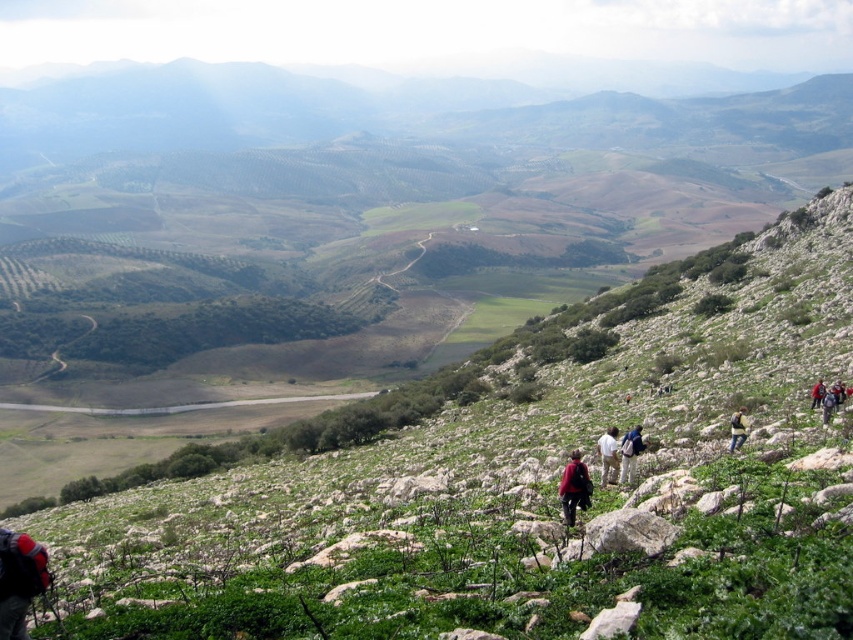
Question: Which is farther from the light brown fabric backpack at lower right?

Choices:
 (A) dark blue backpack at lower right
 (B) red fabric backpack at lower right
 (C) blue fabric backpack at center-right
 (D) dark red backpack at center

Answer: (B)

Question: Which of the following is the farthest from the observer?

Choices:
 (A) dark blue backpack at lower right
 (B) blue fabric backpack at center-right
 (C) light brown fabric backpack at lower right
 (D) dark red backpack at center

Answer: (A)

Question: Can you confirm if blue fabric backpack at center-right is bigger than red fabric backpack at lower right?

Choices:
 (A) no
 (B) yes

Answer: (B)

Question: Is the position of blue fabric backpack at center-right less distant than that of red fabric backpack at lower right?

Choices:
 (A) yes
 (B) no

Answer: (A)

Question: Estimate the real-world distances between objects in this image. Which object is farther from the blue fabric backpack at center-right?

Choices:
 (A) light brown fabric backpack at lower right
 (B) dark blue backpack at lower right

Answer: (B)

Question: Does blue fabric backpack at center-right have a smaller size compared to dark blue backpack at lower right?

Choices:
 (A) no
 (B) yes

Answer: (A)